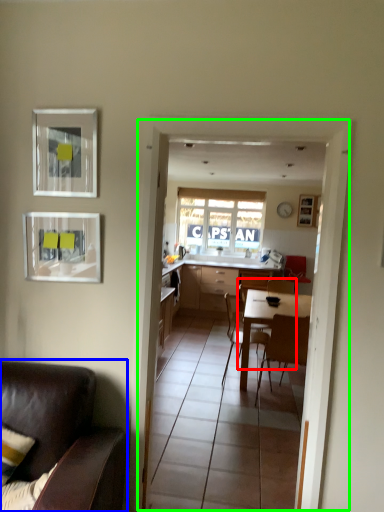
Question: Estimate the real-world distances between objects in this image. Which object is farther from chair (highlighted by a red box), chair (highlighted by a blue box) or glass door (highlighted by a green box)?

Choices:
 (A) chair
 (B) glass door

Answer: (A)